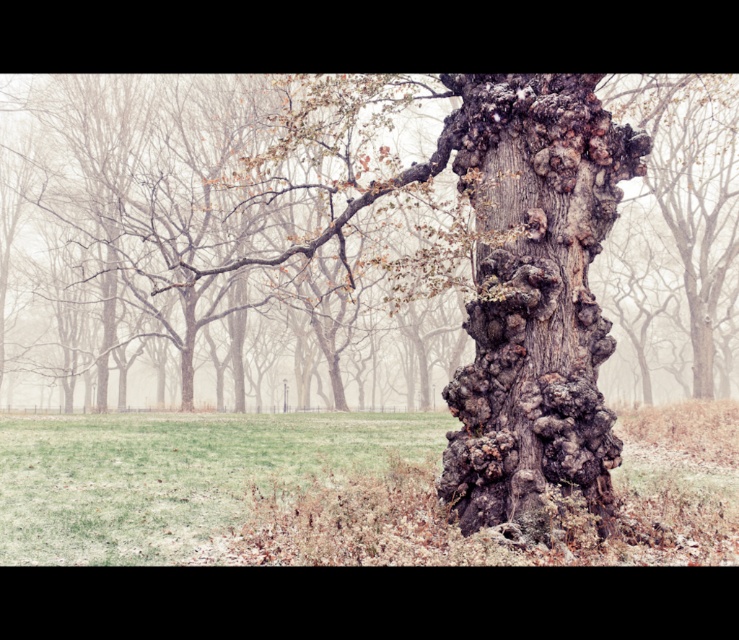
Question: Which object is the closest to the green grass at center?

Choices:
 (A) rough bark tree trunk at center
 (B) dark gray rough bark tree trunk at center
 (C) rough bark oak tree at center

Answer: (B)

Question: Considering the relative positions of rough bark tree trunk at center and green grass at center in the image provided, where is rough bark tree trunk at center located with respect to green grass at center?

Choices:
 (A) right
 (B) left

Answer: (A)

Question: Does rough bark tree trunk at center have a greater width compared to dark gray rough bark tree trunk at center?

Choices:
 (A) yes
 (B) no

Answer: (A)

Question: Which point appears closest to the camera in this image?

Choices:
 (A) (85, 394)
 (B) (505, 348)

Answer: (B)

Question: Which point is closer to the camera?

Choices:
 (A) rough bark oak tree at center
 (B) green grass at center
 (C) dark gray rough bark tree trunk at center
 (D) rough bark tree trunk at center

Answer: (B)

Question: Is rough bark tree trunk at center positioned in front of green grass at center?

Choices:
 (A) yes
 (B) no

Answer: (B)